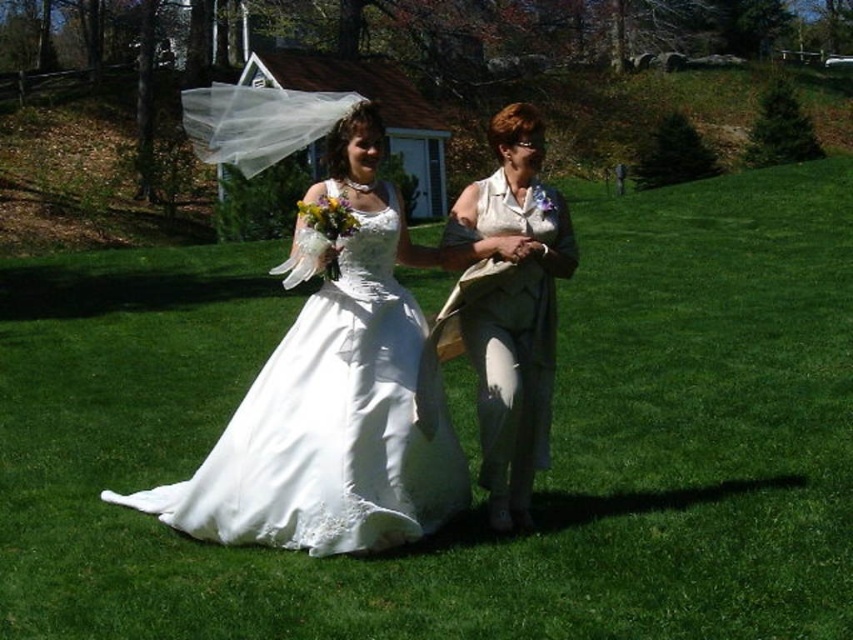
Can you confirm if white satin dress at center is shorter than matte white blouse at center?

No.

Consider the image. Does white satin dress at center have a greater width compared to matte white blouse at center?

Correct, the width of white satin dress at center exceeds that of matte white blouse at center.

Does point (196, 524) come in front of point (561, 244)?

Yes, it is in front of point (561, 244).

Locate an element on the screen. This screenshot has width=853, height=640. white satin dress at center is located at coordinates [x=329, y=426].